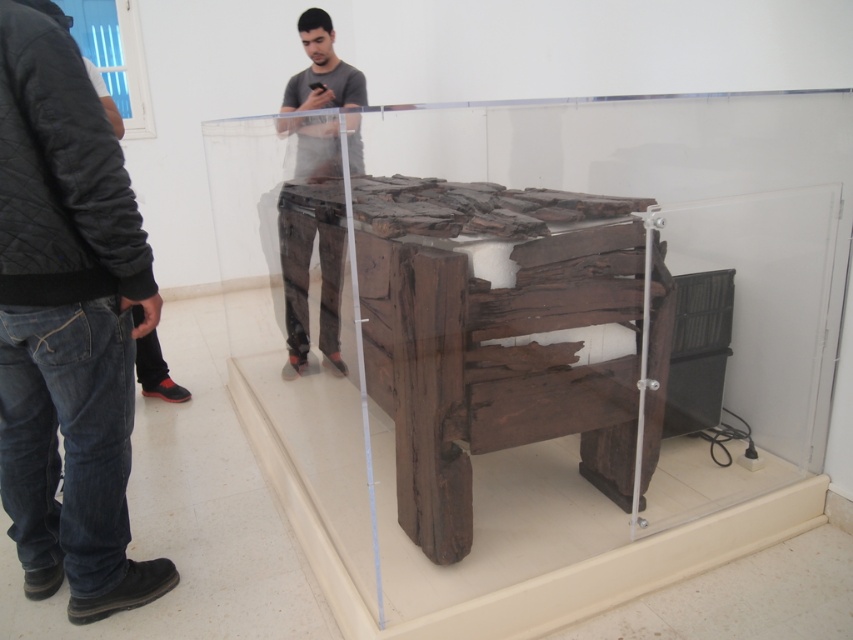
Question: Is dark brown wood at center to the left of dark blue jeans at left from the viewer's perspective?

Choices:
 (A) yes
 (B) no

Answer: (B)

Question: Which object appears closest to the camera in this image?

Choices:
 (A) matte brown pants at center
 (B) dark brown wood at center

Answer: (B)

Question: Estimate the real-world distances between objects in this image. Which object is farther from the matte brown pants at center?

Choices:
 (A) dark blue jeans at left
 (B) dark brown wood at center

Answer: (A)

Question: Which of these objects is positioned farthest from the dark brown wood at center?

Choices:
 (A) dark blue jeans at left
 (B) matte brown pants at center

Answer: (A)

Question: Can you confirm if dark blue jeans at left is positioned to the right of matte brown pants at center?

Choices:
 (A) yes
 (B) no

Answer: (B)

Question: Is dark brown wood at center closer to camera compared to matte brown pants at center?

Choices:
 (A) no
 (B) yes

Answer: (B)